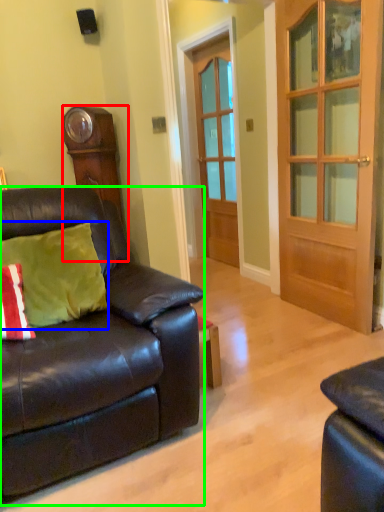
Question: Based on their relative distances, which object is farther from cabinetry (highlighted by a red box)? Choose from pillow (highlighted by a blue box) and studio couch (highlighted by a green box).

Choices:
 (A) pillow
 (B) studio couch

Answer: (B)